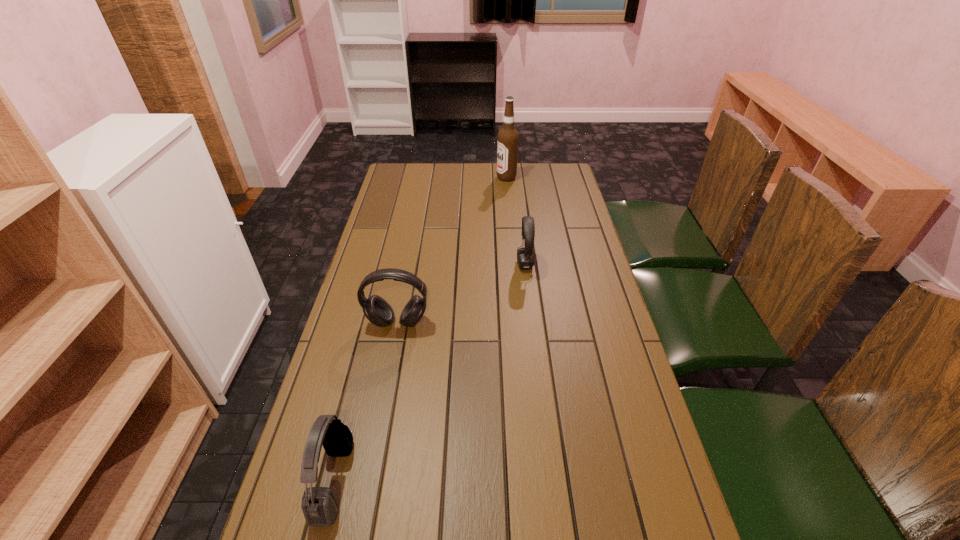
I want to click on the farthest object, so click(507, 141).

At what (x,y) coordinates should I click in order to perform the action: click on the tallest object. Please return your answer as a coordinate pair (x, y). Looking at the image, I should click on (x=507, y=141).

The image size is (960, 540). I want to click on the second farthest headset, so click(x=375, y=308).

Locate an element on the screen. This screenshot has height=540, width=960. the farthest headset is located at coordinates click(525, 256).

Where is `the third nearest object`? This screenshot has height=540, width=960. the third nearest object is located at coordinates (525, 256).

Where is `the nearest headset`? The width and height of the screenshot is (960, 540). the nearest headset is located at coordinates (319, 505).

Locate an element on the screen. vacant space located 0.260m on the label of the farthest object is located at coordinates (436, 178).

Image resolution: width=960 pixels, height=540 pixels. What are the coordinates of `free region located 0.210m on the label of the farthest object` in the screenshot? It's located at (447, 178).

The width and height of the screenshot is (960, 540). What are the coordinates of `blank space located on the label of the farthest object` in the screenshot? It's located at (424, 178).

Identify the location of free spot located 0.270m on the earcups of the third farthest object. This screenshot has height=540, width=960. (379, 419).